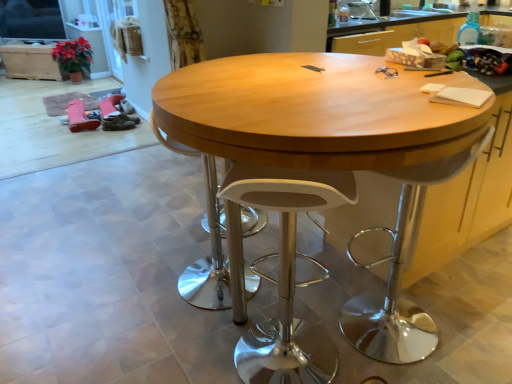
At what (x,y) coordinates should I click in order to perform the action: click on vacant space behind white plastic swivel chair at center, the second swivel chair viewed from the right. Please return your answer as a coordinate pair (x, y). Looking at the image, I should click on (195, 243).